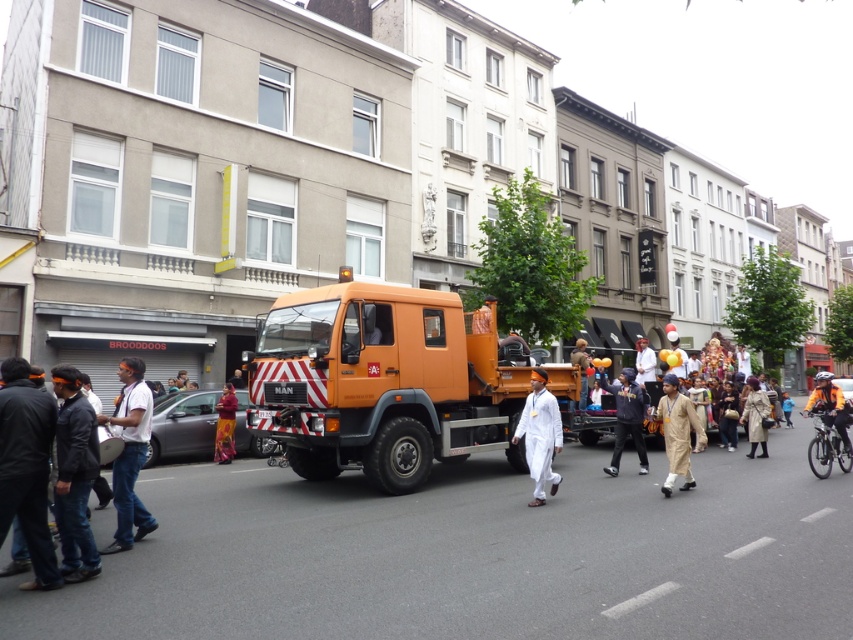
Does light brown cotton kurta at center have a greater width compared to dark blue fabric at center?

In fact, light brown cotton kurta at center might be narrower than dark blue fabric at center.

Which is in front, point (670, 385) or point (622, 369)?

Positioned in front is point (670, 385).

What are the coordinates of `light brown cotton kurta at center` in the screenshot? It's located at (677, 433).

Is the position of black leather jacket at lower left more distant than that of blue jeans at lower left?

That is False.

What do you see at coordinates (26, 467) in the screenshot? I see `black leather jacket at lower left` at bounding box center [26, 467].

The width and height of the screenshot is (853, 640). Identify the location of black leather jacket at lower left. (26, 467).

Who is positioned more to the left, light brown cotton kurta at center or matte orange truck at center?

From the viewer's perspective, matte orange truck at center appears more on the left side.

Does light brown cotton kurta at center have a smaller size compared to matte orange truck at center?

Actually, light brown cotton kurta at center might be larger than matte orange truck at center.

Does point (665, 380) lie in front of point (225, 420)?

That is True.

The width and height of the screenshot is (853, 640). In order to click on light brown cotton kurta at center in this screenshot , I will do `click(677, 433)`.